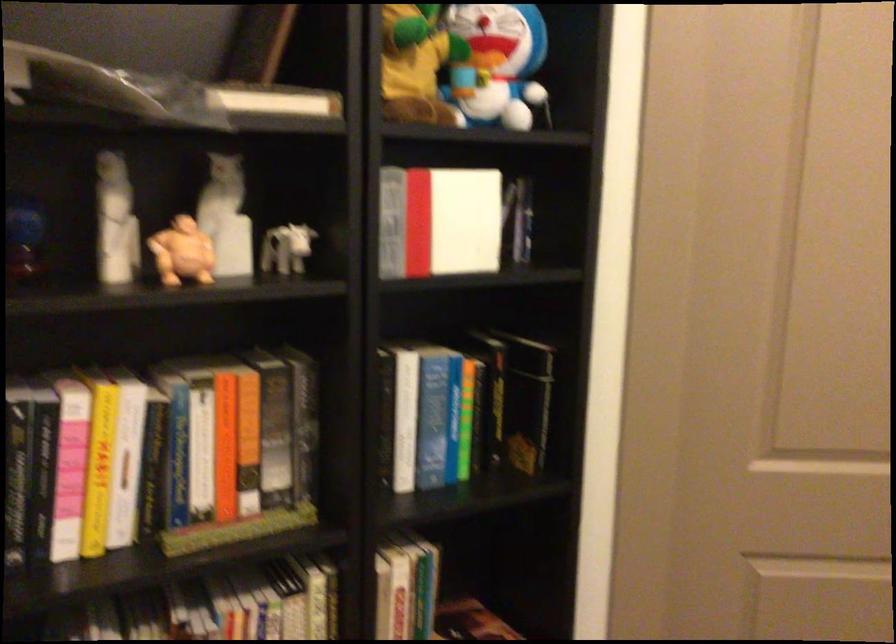
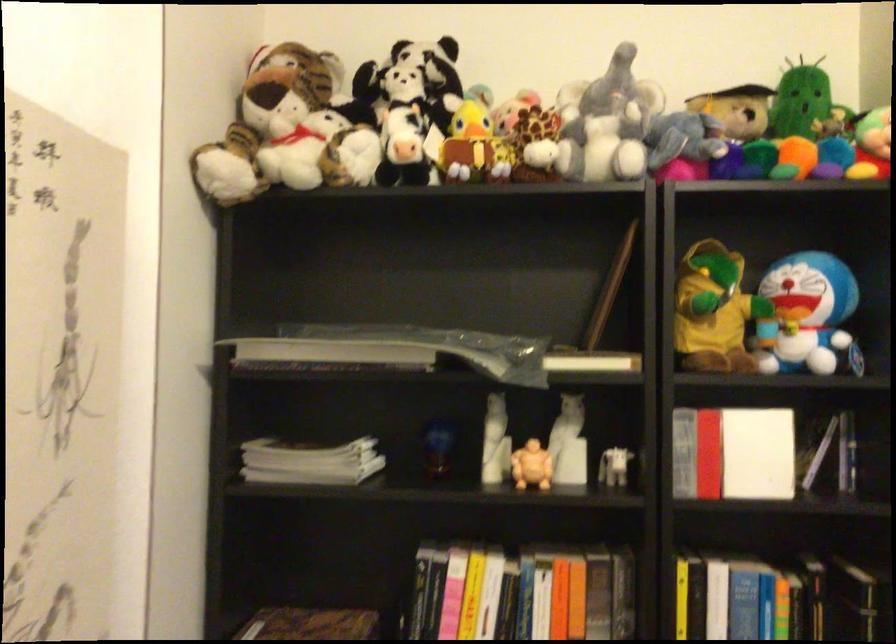
Where in the second image is the point corresponding to pixel 270 104 from the first image?

(591, 361)